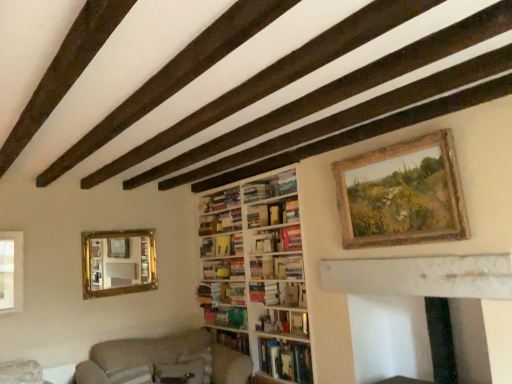
You are a GUI agent. You are given a task and a screenshot of the screen. Output one action in this format:
    pyautogui.click(x=<x>, y=<y>)
    Task: Click on the vacant space situated above gold-framed mirror at left (from a real-world perspective)
    Image resolution: width=512 pixels, height=384 pixels.
    Given the screenshot: What is the action you would take?
    pyautogui.click(x=118, y=230)